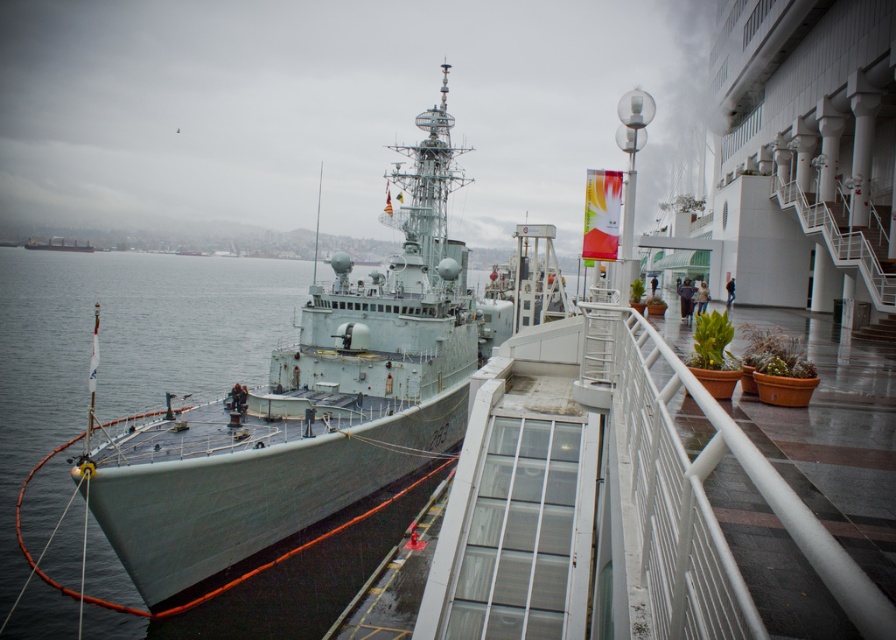
Is point (408, 308) positioned in front of point (54, 600)?

No, it is not.

Can you confirm if gray metallic ship at center is thinner than gray metallic water at left?

Indeed, gray metallic ship at center has a lesser width compared to gray metallic water at left.

Image resolution: width=896 pixels, height=640 pixels. Identify the location of gray metallic ship at center. (307, 406).